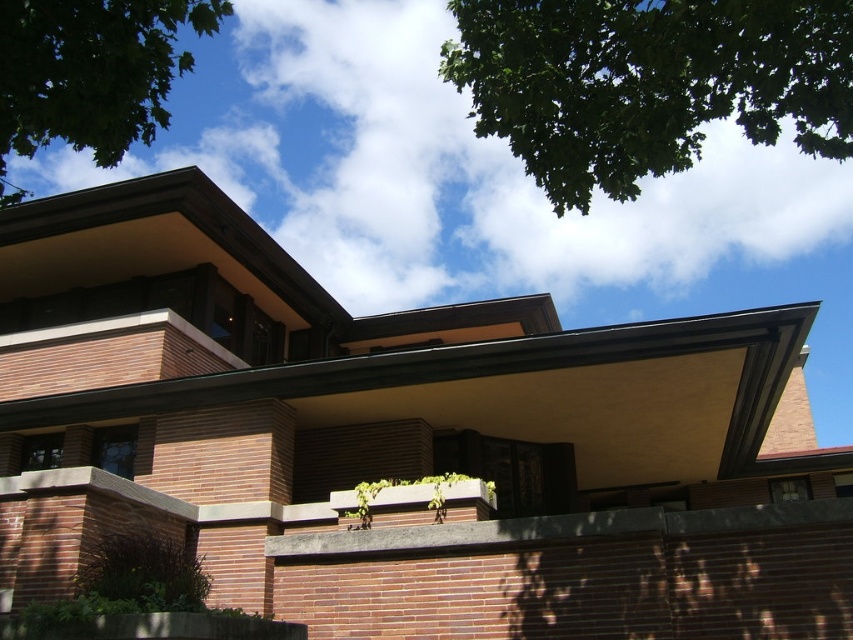
In the scene shown: You are standing 5 meters away from the green leafy tree at upper center. Can you reach it without moving closer?

The green leafy tree at upper center and viewer are 5.61 meters apart, so you are currently 5 meters away from it. Since you are already within 5 meters, you can reach it without moving closer.

You are standing at the base of the building shown in the image. Looking up, you notice a point marked at coordinates (x=647, y=83). What object is located at this point?

The point at coordinates (x=647, y=83) is occupied by a green leafy tree at upper center.